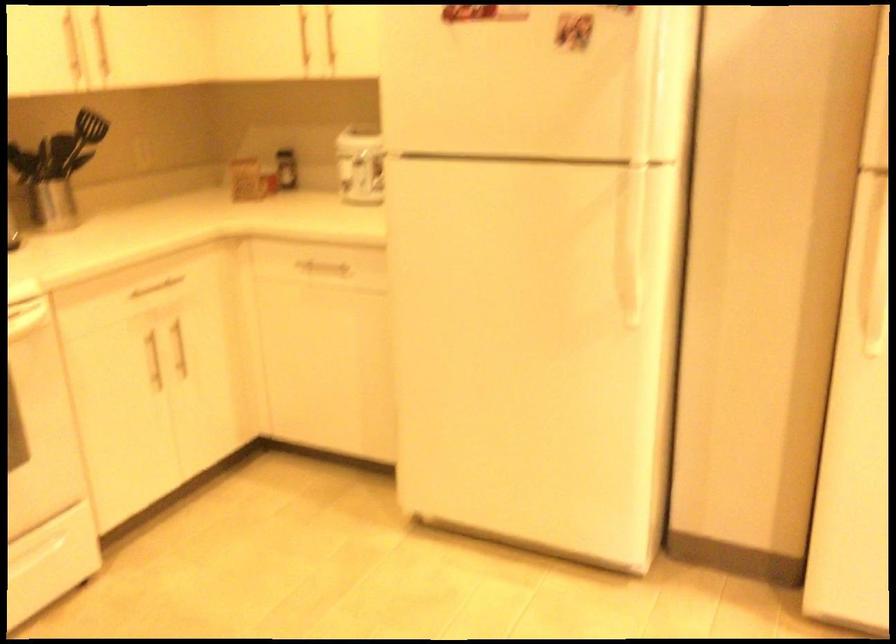
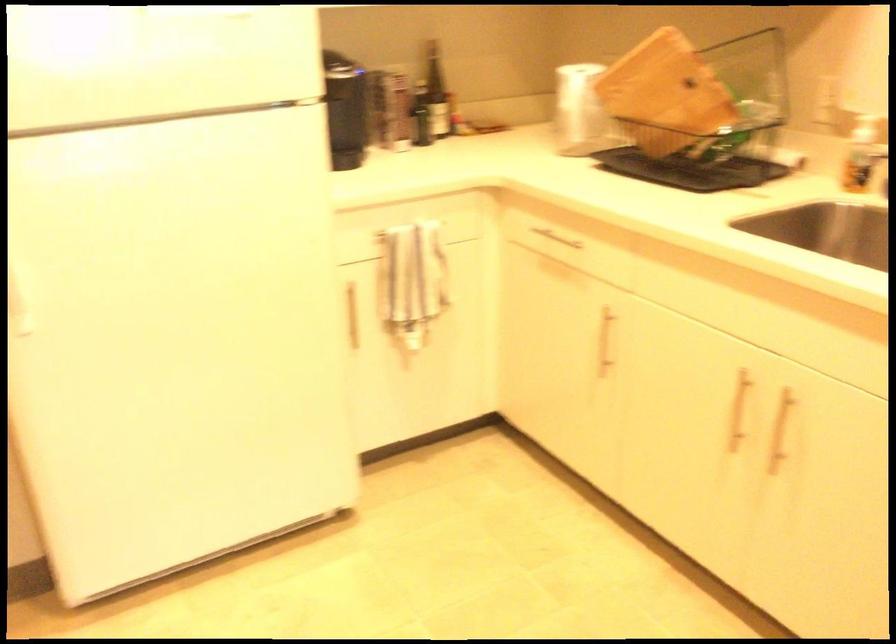
Question: The camera is either moving clockwise (left) or counter-clockwise (right) around the object. The first image is from the beginning of the video and the second image is from the end. Is the camera moving left or right when shooting the video?

Choices:
 (A) Left
 (B) Right

Answer: (A)